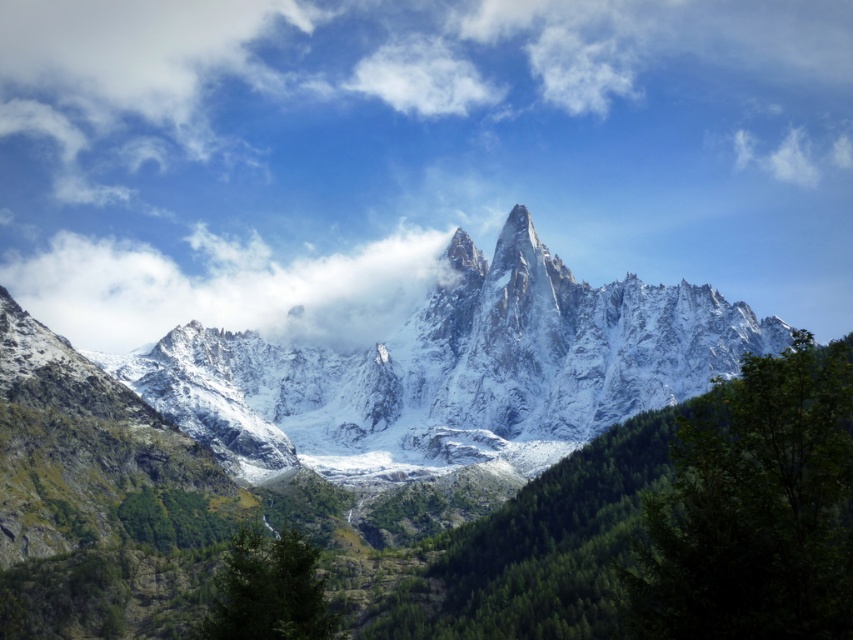
Consider the image. Does snowy granite mountain range at center appear under white fluffy cloud at center?

Yes, snowy granite mountain range at center is below white fluffy cloud at center.

Does snowy granite mountain range at center come behind white fluffy cloud at center?

No.

Is point (291, 380) closer to viewer compared to point (271, 292)?

That is True.

What are the coordinates of `snowy granite mountain range at center` in the screenshot? It's located at 453,371.

Is snowy granite mountain range at center positioned in front of green matte tree at lower center?

That is False.

Does snowy granite mountain range at center have a greater width compared to green matte tree at lower center?

Yes, snowy granite mountain range at center is wider than green matte tree at lower center.

Where is `snowy granite mountain range at center`? snowy granite mountain range at center is located at coordinates (453, 371).

Does snowy granite mountain range at center appear over green leafy tree at lower right?

Indeed, snowy granite mountain range at center is positioned over green leafy tree at lower right.

You are a GUI agent. You are given a task and a screenshot of the screen. Output one action in this format:
    pyautogui.click(x=<x>, y=<y>)
    Task: Click on the snowy granite mountain range at center
    The width and height of the screenshot is (853, 640).
    Given the screenshot: What is the action you would take?
    pyautogui.click(x=453, y=371)